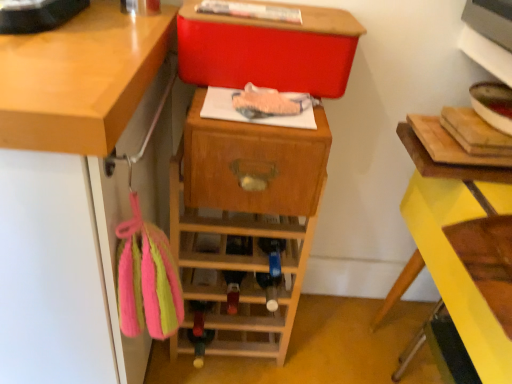
Describe the element at coordinates (244, 224) in the screenshot. I see `wooden wine rack at center` at that location.

Locate an element on the screen. The height and width of the screenshot is (384, 512). wooden wine rack at center is located at coordinates (244, 224).

From the picture: Is yellow painted wood at right outside of wooden drawer at center?

Yes, yellow painted wood at right is located beyond the bounds of wooden drawer at center.

What's the angular difference between yellow painted wood at right and wooden drawer at center's facing directions?

There is a 87.6-degree angle between the facing directions of yellow painted wood at right and wooden drawer at center.

Does yellow painted wood at right have a greater width compared to wooden drawer at center?

Indeed, yellow painted wood at right has a greater width compared to wooden drawer at center.

Is yellow painted wood at right facing towards wooden drawer at center?

Yes, yellow painted wood at right is turned towards wooden drawer at center.

How different are the orientations of yellow painted wood at right and matte red storage box at upper center in degrees?

86.3 degrees.

Does point (404, 369) come behind point (206, 27)?

Yes, point (404, 369) is behind point (206, 27).

You are a GUI agent. You are given a task and a screenshot of the screen. Output one action in this format:
    pyautogui.click(x=<x>, y=<y>)
    Task: Click on the computer desk below the matte red storage box at upper center (from a real-world perspective)
    The image size is (512, 384).
    Given the screenshot: What is the action you would take?
    pyautogui.click(x=451, y=166)

Can you confirm if yellow painted wood at right is wider than matte red storage box at upper center?

Yes.

Based on the photo, which of these two, matte red storage box at upper center or wooden wine rack at center, is wider?

With larger width is wooden wine rack at center.

Looking at this image, from the image's perspective, is matte red storage box at upper center located beneath wooden wine rack at center?

Actually, matte red storage box at upper center appears above wooden wine rack at center in the image.

Could you tell me if matte red storage box at upper center is facing wooden wine rack at center?

No, matte red storage box at upper center is not facing towards wooden wine rack at center.

Does matte red storage box at upper center contain wooden wine rack at center?

No.

Does wooden drawer at center have a lesser height compared to wooden wine rack at center?

Yes.

From the picture: Which of these two, wooden drawer at center or wooden wine rack at center, is wider?

wooden wine rack at center.

Is point (260, 166) closer or farther from the camera than point (205, 119)?

Clearly, point (260, 166) is more distant from the camera than point (205, 119).

Is wooden drawer at center in front of wooden wine rack at center?

Yes, wooden drawer at center is closer to the camera.

Find the location of a particular element. The height and width of the screenshot is (384, 512). shelf to the left of yellow painted wood at right is located at coordinates (244, 224).

Considering the sizes of objects wooden wine rack at center and yellow painted wood at right in the image provided, who is taller, wooden wine rack at center or yellow painted wood at right?

Standing taller between the two is yellow painted wood at right.

From the picture: Who is smaller, wooden wine rack at center or yellow painted wood at right?

wooden wine rack at center is smaller.

Looking at this image, which object is further away from the camera, wooden wine rack at center or yellow painted wood at right?

wooden wine rack at center is behind.

Is yellow painted wood at right thinner than wooden wine rack at center?

Incorrect, the width of yellow painted wood at right is not less than that of wooden wine rack at center.

From the image's perspective, which object appears higher, yellow painted wood at right or wooden wine rack at center?

wooden wine rack at center appears higher in the image.

Would you say yellow painted wood at right contains wooden wine rack at center?

Actually, wooden wine rack at center is outside yellow painted wood at right.

Measure the distance from yellow painted wood at right to wooden wine rack at center.

yellow painted wood at right and wooden wine rack at center are 48.77 centimeters apart from each other.

Does wooden wine rack at center have a greater width compared to wooden drawer at center?

Yes.

Considering the relative sizes of wooden wine rack at center and wooden drawer at center in the image provided, is wooden wine rack at center smaller than wooden drawer at center?

Incorrect, wooden wine rack at center is not smaller in size than wooden drawer at center.

In the scene shown: Which is farther, (x=232, y=187) or (x=310, y=149)?

The point (x=232, y=187) is more distant.

Where is `drawer that is behind the yellow painted wood at right`? drawer that is behind the yellow painted wood at right is located at coordinates (254, 172).

Locate an element on the screen. The height and width of the screenshot is (384, 512). computer desk below the matte red storage box at upper center (from the image's perspective) is located at coordinates (451, 166).

Estimate the real-world distances between objects in this image. Which object is further from yellow painted wood at right, matte red storage box at upper center or wooden wine rack at center?

Based on the image, wooden wine rack at center appears to be further to yellow painted wood at right.

When comparing their distances from wooden drawer at center, does wooden wine rack at center or yellow painted wood at right seem further?

yellow painted wood at right is positioned further to the anchor wooden drawer at center.

Looking at this image, when comparing their distances from matte red storage box at upper center, does wooden wine rack at center or wooden drawer at center seem further?

Among the two, wooden wine rack at center is located further to matte red storage box at upper center.

When comparing their distances from matte red storage box at upper center, does yellow painted wood at right or wooden drawer at center seem further?

Based on the image, yellow painted wood at right appears to be further to matte red storage box at upper center.

Looking at this image, when comparing their distances from yellow painted wood at right, does wooden wine rack at center or wooden drawer at center seem further?

wooden wine rack at center is positioned further to the anchor yellow painted wood at right.

Which object lies further to the anchor point wooden wine rack at center, wooden drawer at center or matte red storage box at upper center?

matte red storage box at upper center is further to wooden wine rack at center.

In the scene shown: From the image, which object appears to be farther from wooden wine rack at center, yellow painted wood at right or matte red storage box at upper center?

yellow painted wood at right lies further to wooden wine rack at center than the other object.

Considering their positions, is yellow painted wood at right positioned closer to wooden drawer at center than matte red storage box at upper center?

Based on the image, matte red storage box at upper center appears to be nearer to wooden drawer at center.

Where is `drawer between matte red storage box at upper center and wooden wine rack at center in the up-down direction`? The height and width of the screenshot is (384, 512). drawer between matte red storage box at upper center and wooden wine rack at center in the up-down direction is located at coordinates (254, 172).

Where is `storage box between wooden wine rack at center and yellow painted wood at right in the horizontal direction`? This screenshot has width=512, height=384. storage box between wooden wine rack at center and yellow painted wood at right in the horizontal direction is located at coordinates (268, 51).

You are a GUI agent. You are given a task and a screenshot of the screen. Output one action in this format:
    pyautogui.click(x=<x>, y=<y>)
    Task: Click on the drawer situated between wooden wine rack at center and yellow painted wood at right from left to right
    The width and height of the screenshot is (512, 384).
    Given the screenshot: What is the action you would take?
    pyautogui.click(x=254, y=172)

Locate an element on the screen. storage box situated between wooden drawer at center and yellow painted wood at right from left to right is located at coordinates (268, 51).